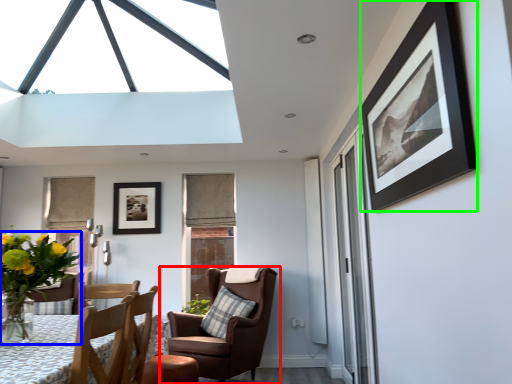
Question: Which object is the farthest from chair (highlighted by a red box)? Choose among these: houseplant (highlighted by a blue box) or picture frame (highlighted by a green box).

Choices:
 (A) houseplant
 (B) picture frame

Answer: (B)